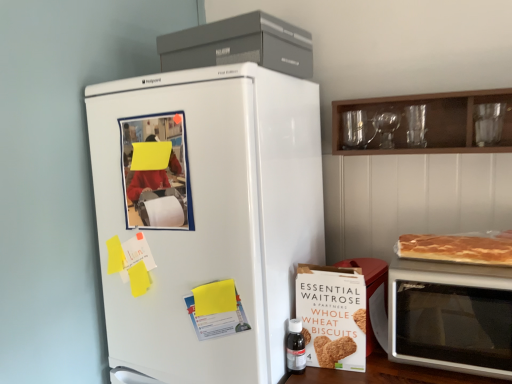
Where is `silver metallic microwave at right`? silver metallic microwave at right is located at coordinates (451, 317).

Locate an element on the screen. Image resolution: width=512 pixels, height=384 pixels. white cardboard box of whole wheat biscuits at lower right is located at coordinates (332, 316).

Find the location of a particular element. This screenshot has height=384, width=512. wooden cabinet at upper right is located at coordinates (430, 122).

Describe the element at coordinates (204, 219) in the screenshot. I see `white matte refrigerator at left` at that location.

Measure the distance between point (282, 46) and camera.

Point (282, 46) is 1.13 meters from camera.

Locate an element on the screen. silver metallic microwave at right is located at coordinates (451, 317).

Consider the image. Would you say white cardboard box of whole wheat biscuits at lower right is outside silver metallic microwave at right?

Yes, white cardboard box of whole wheat biscuits at lower right is outside of silver metallic microwave at right.

From their relative heights in the image, would you say white cardboard box of whole wheat biscuits at lower right is taller or shorter than silver metallic microwave at right?

Considering their sizes, white cardboard box of whole wheat biscuits at lower right has less height than silver metallic microwave at right.

Between white cardboard box of whole wheat biscuits at lower right and silver metallic microwave at right, which one has smaller width?

white cardboard box of whole wheat biscuits at lower right.

Which is closer, (343, 348) or (435, 312)?

Clearly, point (343, 348) is more distant from the camera than point (435, 312).

Would you say transparent plastic bottle at lower right is a long distance from silver metallic microwave at right?

No, there isn't a large distance between transparent plastic bottle at lower right and silver metallic microwave at right.

The width and height of the screenshot is (512, 384). Identify the location of bottle on the left of silver metallic microwave at right. (295, 347).

Based on their sizes in the image, would you say transparent plastic bottle at lower right is bigger or smaller than silver metallic microwave at right?

In the image, transparent plastic bottle at lower right appears to be smaller than silver metallic microwave at right.

From the image's perspective, which object appears higher, white matte refrigerator at left or transparent plastic bottle at lower right?

white matte refrigerator at left.

Considering the relative positions of white matte refrigerator at left and transparent plastic bottle at lower right in the image provided, is white matte refrigerator at left to the right of transparent plastic bottle at lower right from the viewer's perspective?

No.

Between white matte refrigerator at left and transparent plastic bottle at lower right, which one has larger size?

white matte refrigerator at left.

How far apart are white matte refrigerator at left and transparent plastic bottle at lower right?

17.05 inches.

From the image's perspective, would you say silver metallic microwave at right is shown under golden brown flaky pancake at right?

Yes, from the image's perspective, silver metallic microwave at right is beneath golden brown flaky pancake at right.

From a real-world perspective, is silver metallic microwave at right positioned above or below golden brown flaky pancake at right?

Clearly, from a real-world perspective, silver metallic microwave at right is below golden brown flaky pancake at right.

Is silver metallic microwave at right aimed at golden brown flaky pancake at right?

No, silver metallic microwave at right does not turn towards golden brown flaky pancake at right.

Is silver metallic microwave at right to the left or to the right of golden brown flaky pancake at right in the image?

silver metallic microwave at right is to the left of golden brown flaky pancake at right.

In the image, is transparent plastic bottle at lower right on the left side or the right side of white cardboard box of whole wheat biscuits at lower right?

Based on their positions, transparent plastic bottle at lower right is located to the left of white cardboard box of whole wheat biscuits at lower right.

Is transparent plastic bottle at lower right far away from white cardboard box of whole wheat biscuits at lower right?

No, transparent plastic bottle at lower right is not far from white cardboard box of whole wheat biscuits at lower right.

From a real-world perspective, which object stands above the other?

In real-world perspective, white cardboard box of whole wheat biscuits at lower right is above.

Is transparent plastic bottle at lower right turned away from white cardboard box of whole wheat biscuits at lower right?

Yes.

Could you tell me if matte gray refrigerator at upper center is turned towards wooden cabinet at upper right?

No, matte gray refrigerator at upper center is not facing towards wooden cabinet at upper right.

Is matte gray refrigerator at upper center to the right of wooden cabinet at upper right from the viewer's perspective?

No, matte gray refrigerator at upper center is not to the right of wooden cabinet at upper right.

Between point (207, 47) and point (439, 105), which one is positioned in front?

The point (207, 47) is closer to the camera.

Can you see silver metallic microwave at right touching matte gray refrigerator at upper center?

No, silver metallic microwave at right is not touching matte gray refrigerator at upper center.

From the image's perspective, who appears lower, silver metallic microwave at right or matte gray refrigerator at upper center?

silver metallic microwave at right is shown below in the image.

Is silver metallic microwave at right situated inside matte gray refrigerator at upper center or outside?

silver metallic microwave at right cannot be found inside matte gray refrigerator at upper center.

From a real-world perspective, is silver metallic microwave at right on top of matte gray refrigerator at upper center?

No, from a real-world perspective, silver metallic microwave at right is not over matte gray refrigerator at upper center

Where is `microwave oven located in front of the white cardboard box of whole wheat biscuits at lower right`? The height and width of the screenshot is (384, 512). microwave oven located in front of the white cardboard box of whole wheat biscuits at lower right is located at coordinates (451, 317).

I want to click on microwave oven that appears above the transparent plastic bottle at lower right (from the image's perspective), so click(451, 317).

Estimate the real-world distances between objects in this image. Which object is closer to silver metallic microwave at right, white cardboard box of whole wheat biscuits at lower right or golden brown flaky pancake at right?

Based on the image, golden brown flaky pancake at right appears to be nearer to silver metallic microwave at right.

Based on their spatial positions, is wooden cabinet at upper right or golden brown flaky pancake at right closer to silver metallic microwave at right?

Among the two, golden brown flaky pancake at right is located nearer to silver metallic microwave at right.

Looking at the image, which one is located further to silver metallic microwave at right, white matte refrigerator at left or transparent plastic bottle at lower right?

white matte refrigerator at left.

Estimate the real-world distances between objects in this image. Which object is further from wooden cabinet at upper right, silver metallic microwave at right or white matte refrigerator at left?

white matte refrigerator at left lies further to wooden cabinet at upper right than the other object.

Based on their spatial positions, is transparent plastic bottle at lower right or white matte refrigerator at left further from silver metallic microwave at right?

The object further to silver metallic microwave at right is white matte refrigerator at left.

Based on their spatial positions, is transparent plastic bottle at lower right or white cardboard box of whole wheat biscuits at lower right further from silver metallic microwave at right?

Based on the image, transparent plastic bottle at lower right appears to be further to silver metallic microwave at right.

Considering their positions, is golden brown flaky pancake at right positioned further to silver metallic microwave at right than matte gray refrigerator at upper center?

matte gray refrigerator at upper center.

Considering their positions, is white cardboard box of whole wheat biscuits at lower right positioned further to white matte refrigerator at left than matte gray refrigerator at upper center?

matte gray refrigerator at upper center.

Locate an element on the screen. refrigerator between wooden cabinet at upper right and white cardboard box of whole wheat biscuits at lower right vertically is located at coordinates (204, 219).

Find the location of a particular element. microwave oven between matte gray refrigerator at upper center and white cardboard box of whole wheat biscuits at lower right in the vertical direction is located at coordinates (451, 317).

The height and width of the screenshot is (384, 512). I want to click on microwave oven between white matte refrigerator at left and golden brown flaky pancake at right in the horizontal direction, so coord(451,317).

You are a GUI agent. You are given a task and a screenshot of the screen. Output one action in this format:
    pyautogui.click(x=<x>, y=<y>)
    Task: Click on the microwave oven that lies between wooden cabinet at upper right and transparent plastic bottle at lower right from top to bottom
    
    Given the screenshot: What is the action you would take?
    pyautogui.click(x=451, y=317)